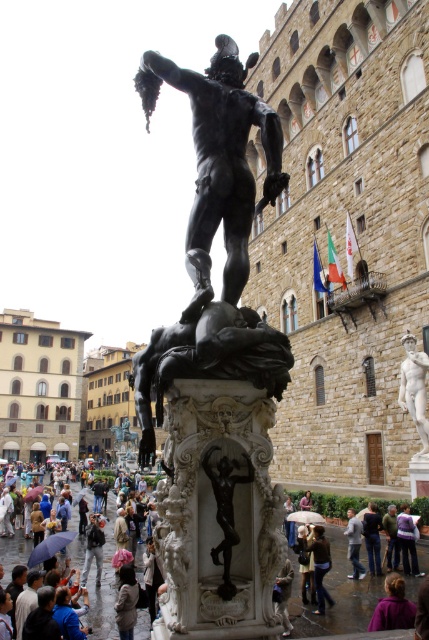
Question: Among these points, which one is nearest to the camera?

Choices:
 (A) (99, 628)
 (B) (401, 612)
 (C) (359, 522)

Answer: (B)

Question: Does bronze statue at center have a greater width compared to light blue jeans at center?

Choices:
 (A) yes
 (B) no

Answer: (A)

Question: Which of the following is the farthest from the observer?

Choices:
 (A) light blue jeans at center
 (B) purple fabric at lower right

Answer: (A)

Question: Is purple fabric at lower right in front of brown leather jacket at center?

Choices:
 (A) no
 (B) yes

Answer: (B)

Question: Which of the following is the closest to the observer?

Choices:
 (A) (320, 552)
 (B) (232, 93)
 (C) (405, 348)

Answer: (B)

Question: Is white marble statue at upper right above brown leather jacket at center?

Choices:
 (A) no
 (B) yes

Answer: (B)